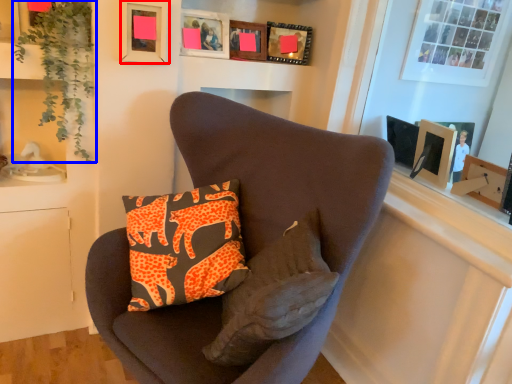
Question: Among these objects, which one is nearest to the camera, picture frame (highlighted by a red box) or plant (highlighted by a blue box)?

Choices:
 (A) picture frame
 (B) plant

Answer: (B)